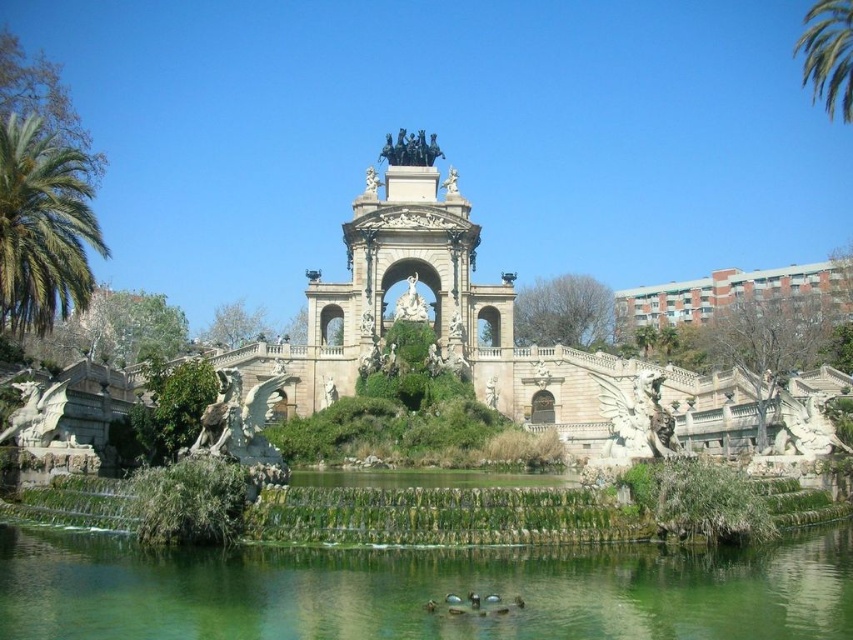
Question: Which point is closer to the camera?

Choices:
 (A) green leafy palm tree at upper right
 (B) white stone palace at center
 (C) green water at center
 (D) green leafy palm tree at left

Answer: (C)

Question: Does white stone palace at center lie in front of green leafy palm tree at left?

Choices:
 (A) yes
 (B) no

Answer: (A)

Question: Considering the real-world distances, which object is closest to the green leafy palm tree at left?

Choices:
 (A) green leafy palm tree at upper right
 (B) white stone palace at center

Answer: (B)

Question: Can you confirm if green leafy palm tree at left is smaller than green leafy palm tree at upper right?

Choices:
 (A) yes
 (B) no

Answer: (A)

Question: Does green leafy palm tree at left have a smaller size compared to green leafy palm tree at upper right?

Choices:
 (A) yes
 (B) no

Answer: (A)

Question: Which object is positioned closest to the green leafy palm tree at upper right?

Choices:
 (A) white stone palace at center
 (B) green leafy palm tree at left
 (C) green water at center

Answer: (A)